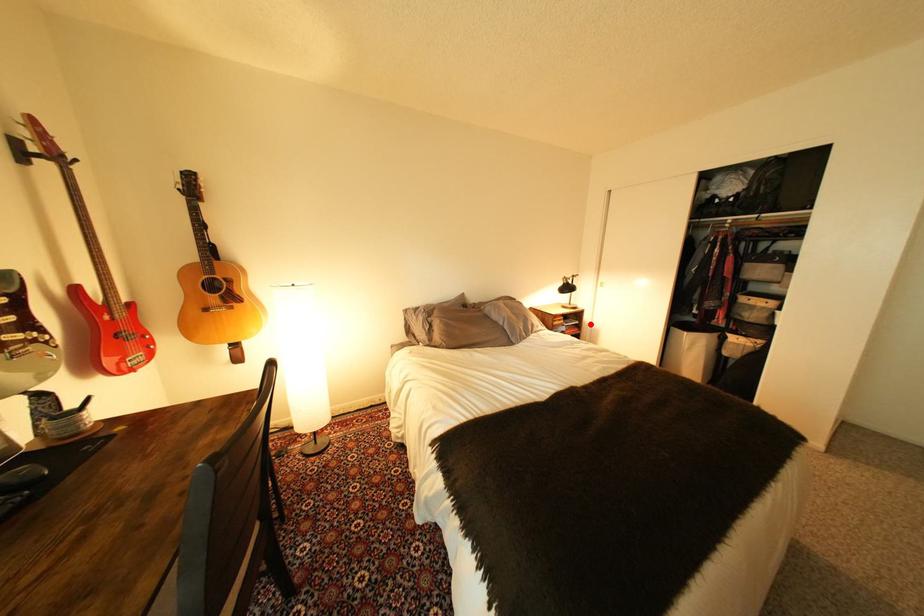
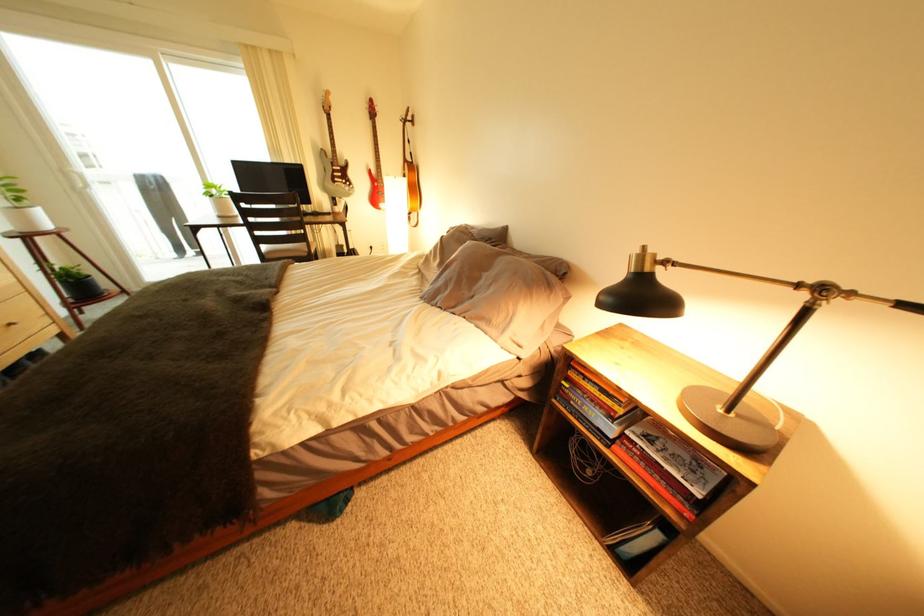
Question: I am providing you with two images of the same scene from different viewpoints. A red point is marked on the first image. At the location where the point appears in image 1, is it still visible in image 2?

Choices:
 (A) Yes
 (B) No

Answer: (A)